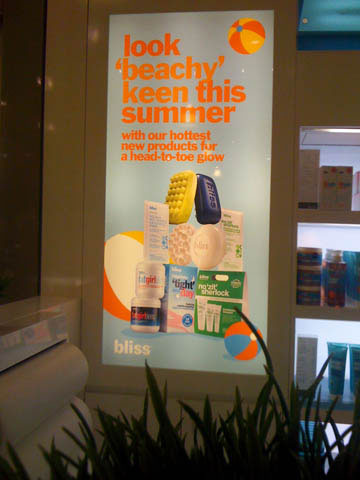
Locate an element on the screen. This screenshot has width=360, height=480. backlit shelf backing is located at coordinates (330, 328), (330, 439), (335, 230), (344, 154).